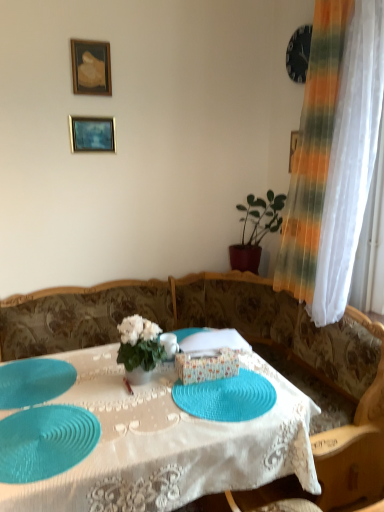
Locate an element on the screen. Image resolution: width=384 pixels, height=512 pixels. vacant space in between teal woven placemat at center, the 3th glass plate positioned from the left, and teal rubber placemat at lower left, the second glass plate in the right-to-left sequence is located at coordinates (145, 418).